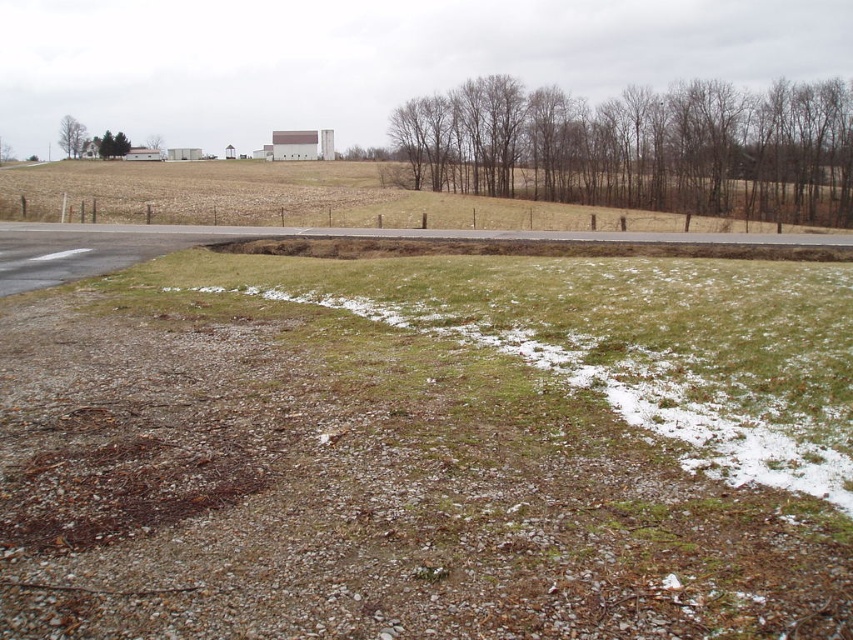
Which of these two, green grassy field at upper center or green leafy tree at upper left, stands shorter?

Standing shorter between the two is green leafy tree at upper left.

Which of these two, green grassy field at upper center or green leafy tree at upper left, stands taller?

green grassy field at upper center

This screenshot has height=640, width=853. What do you see at coordinates (282, 196) in the screenshot?
I see `green grassy field at upper center` at bounding box center [282, 196].

Where is `green grassy field at upper center`? This screenshot has width=853, height=640. green grassy field at upper center is located at coordinates (282, 196).

Between point (495, 145) and point (80, 147), which one is positioned in front?

Point (495, 145) is in front.

Measure the distance between bare wood trees at upper right and green leafy tree at upper left.

bare wood trees at upper right is 141.09 meters from green leafy tree at upper left.

This screenshot has height=640, width=853. What are the coordinates of `bare wood trees at upper right` in the screenshot? It's located at (639, 147).

The width and height of the screenshot is (853, 640). In order to click on bare wood trees at upper right in this screenshot , I will do `click(639, 147)`.

Does bare wood trees at upper right appear on the right side of green grassy field at upper center?

Yes, bare wood trees at upper right is to the right of green grassy field at upper center.

Is point (709, 148) closer to camera compared to point (189, 180)?

Yes, point (709, 148) is in front of point (189, 180).

Between point (721, 193) and point (222, 170), which one is positioned behind?

The point (222, 170) is behind.

You are a GUI agent. You are given a task and a screenshot of the screen. Output one action in this format:
    pyautogui.click(x=<x>, y=<y>)
    Task: Click on the bare wood trees at upper right
    This screenshot has width=853, height=640.
    Given the screenshot: What is the action you would take?
    pyautogui.click(x=639, y=147)